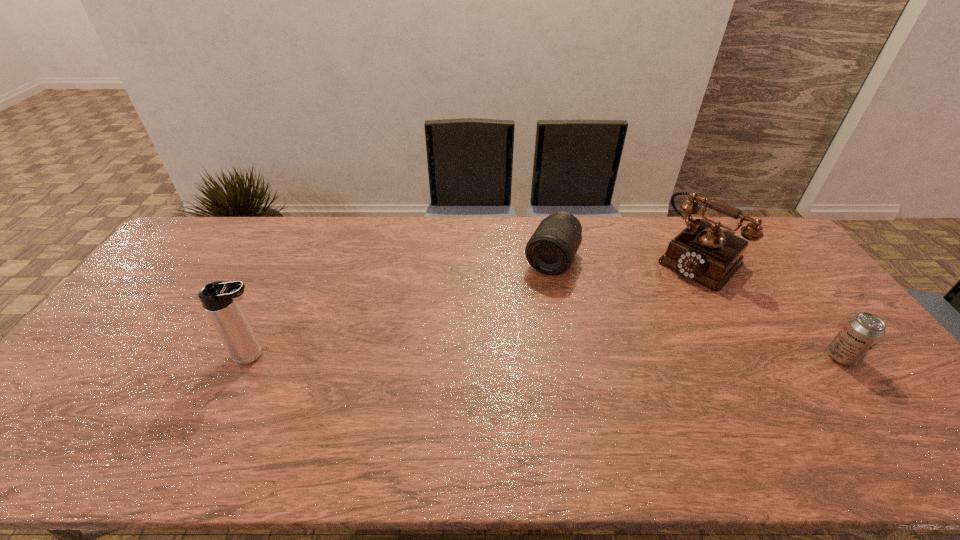
Locate an element on the screen. This screenshot has width=960, height=540. free spot on the desktop that is between the thermos bottle and the beer can and is positioned on the dial of the telephone is located at coordinates (595, 356).

Locate an element on the screen. The width and height of the screenshot is (960, 540). vacant spot on the desktop that is between the thermos bottle and the beer can and is positioned on the surface of the telephoto lens is located at coordinates (502, 356).